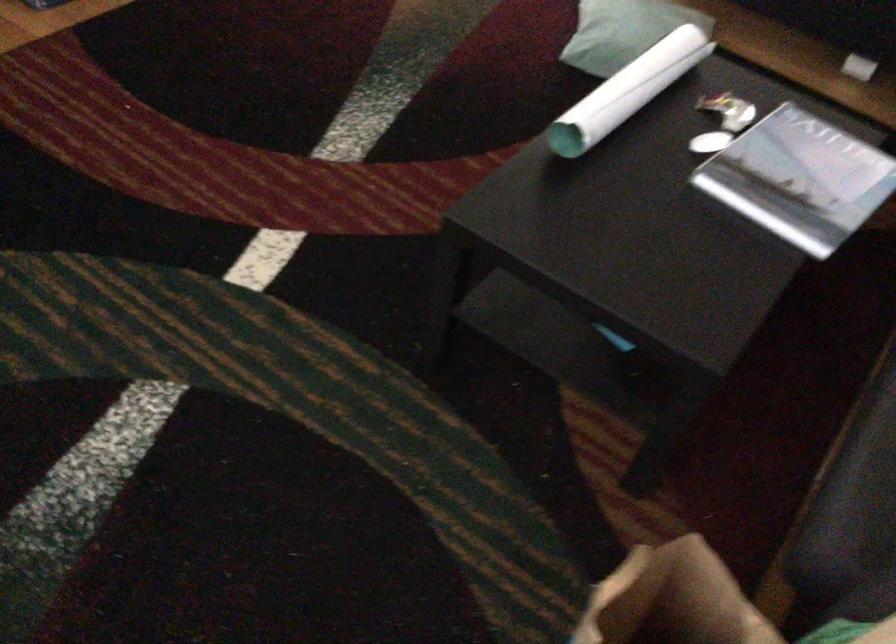
The location [737,114] corresponds to which object?

This point indicates the crumpled candy wrapper.